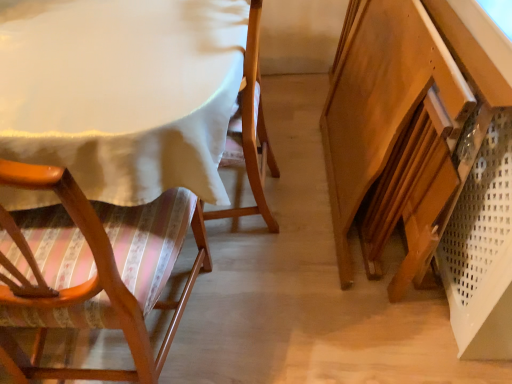
Question: Does wooden vanity at lower right have a lesser height compared to white fabric table at upper left?

Choices:
 (A) no
 (B) yes

Answer: (A)

Question: From a real-world perspective, is wooden vanity at lower right under white fabric table at upper left?

Choices:
 (A) no
 (B) yes

Answer: (A)

Question: From the image's perspective, is wooden vanity at lower right above white fabric table at upper left?

Choices:
 (A) yes
 (B) no

Answer: (B)

Question: Considering the relative sizes of wooden vanity at lower right and white fabric table at upper left in the image provided, is wooden vanity at lower right smaller than white fabric table at upper left?

Choices:
 (A) no
 (B) yes

Answer: (B)

Question: Would you say wooden vanity at lower right is a long distance from white fabric table at upper left?

Choices:
 (A) no
 (B) yes

Answer: (A)

Question: Would you say wooden chair with striped cushion at left is inside or outside white fabric table at upper left?

Choices:
 (A) inside
 (B) outside

Answer: (A)

Question: From their relative heights in the image, would you say wooden chair with striped cushion at left is taller or shorter than white fabric table at upper left?

Choices:
 (A) short
 (B) tall

Answer: (B)

Question: In terms of width, does wooden chair with striped cushion at left look wider or thinner when compared to white fabric table at upper left?

Choices:
 (A) wide
 (B) thin

Answer: (B)

Question: Is point (176, 218) closer or farther from the camera than point (179, 183)?

Choices:
 (A) farther
 (B) closer

Answer: (A)

Question: Does point (353, 213) appear closer or farther from the camera than point (17, 175)?

Choices:
 (A) closer
 (B) farther

Answer: (B)

Question: From their relative heights in the image, would you say wooden vanity at lower right is taller or shorter than wooden chair with striped cushion at left?

Choices:
 (A) short
 (B) tall

Answer: (A)

Question: Based on their sizes in the image, would you say wooden vanity at lower right is bigger or smaller than wooden chair with striped cushion at left?

Choices:
 (A) small
 (B) big

Answer: (A)

Question: From a real-world perspective, is wooden vanity at lower right above or below wooden chair with striped cushion at left?

Choices:
 (A) above
 (B) below

Answer: (B)

Question: From a real-world perspective, relative to wooden chair with striped cushion at left, is white fabric table at upper left vertically above or below?

Choices:
 (A) above
 (B) below

Answer: (B)

Question: From the image's perspective, is white fabric table at upper left positioned above or below wooden chair with striped cushion at left?

Choices:
 (A) below
 (B) above

Answer: (B)